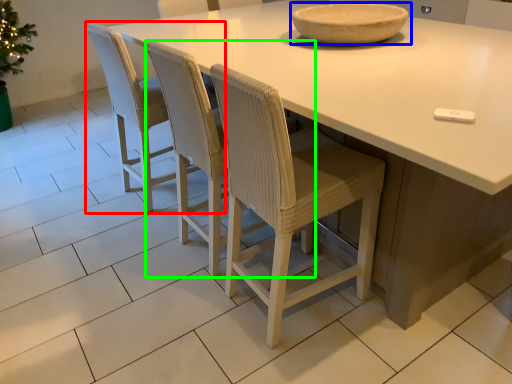
Question: Which is farther away from chair (highlighted by a red box)? bowl (highlighted by a blue box) or chair (highlighted by a green box)?

Choices:
 (A) bowl
 (B) chair

Answer: (A)